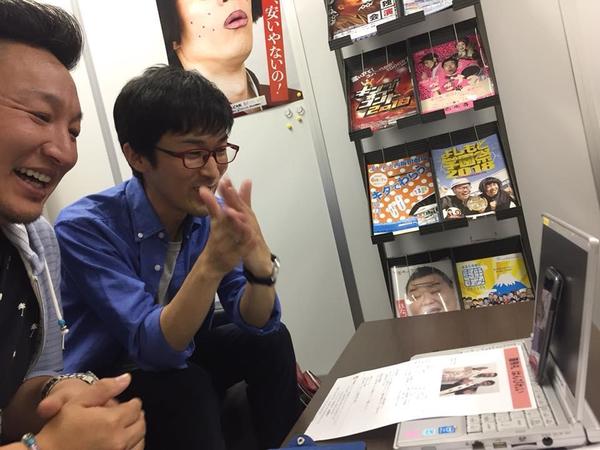
At what (x,y) coordinates should I click in order to perform the action: click on laptop screen. Please return your answer as a coordinate pair (x, y). Looking at the image, I should click on (572, 311).